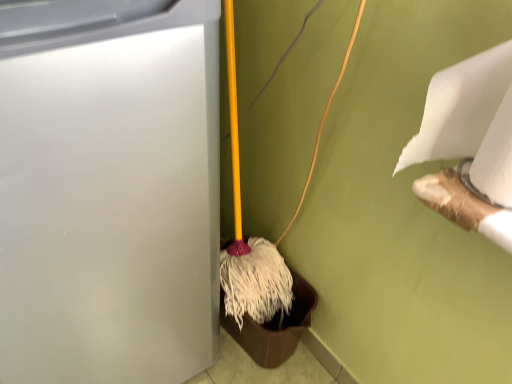
Question: Is white matte toilet paper at upper right, positioned as the 1th toilet paper in left-to-right order, facing towards white matte waste container at left?

Choices:
 (A) no
 (B) yes

Answer: (A)

Question: From a real-world perspective, is white matte toilet paper at upper right, positioned as the 1th toilet paper in left-to-right order, located higher than white matte waste container at left?

Choices:
 (A) yes
 (B) no

Answer: (A)

Question: From a real-world perspective, is white matte toilet paper at upper right, positioned as the 1th toilet paper in left-to-right order, located beneath white matte waste container at left?

Choices:
 (A) no
 (B) yes

Answer: (A)

Question: Considering the relative sizes of white matte toilet paper at upper right, placed as the 2th toilet paper when sorted from right to left, and white matte waste container at left in the image provided, is white matte toilet paper at upper right, placed as the 2th toilet paper when sorted from right to left, smaller than white matte waste container at left?

Choices:
 (A) yes
 (B) no

Answer: (A)

Question: Are white matte toilet paper at upper right, positioned as the 1th toilet paper in left-to-right order, and white matte waste container at left located far from each other?

Choices:
 (A) yes
 (B) no

Answer: (B)

Question: Does white matte toilet paper at upper right, placed as the 2th toilet paper when sorted from right to left, have a greater height compared to white matte waste container at left?

Choices:
 (A) yes
 (B) no

Answer: (B)

Question: Does white matte toilet paper at upper right, positioned as the 1th toilet paper in left-to-right order, turn towards white matte toilet paper at upper right, which is the 1th toilet paper in right-to-left order?

Choices:
 (A) no
 (B) yes

Answer: (B)

Question: Does white matte toilet paper at upper right, positioned as the 1th toilet paper in left-to-right order, have a lesser height compared to white matte toilet paper at upper right, which is the second toilet paper in left-to-right order?

Choices:
 (A) no
 (B) yes

Answer: (B)

Question: Considering the relative sizes of white matte toilet paper at upper right, placed as the 2th toilet paper when sorted from right to left, and white matte toilet paper at upper right, which is the 1th toilet paper in right-to-left order, in the image provided, is white matte toilet paper at upper right, placed as the 2th toilet paper when sorted from right to left, taller than white matte toilet paper at upper right, which is the 1th toilet paper in right-to-left order,?

Choices:
 (A) yes
 (B) no

Answer: (B)

Question: Does white matte toilet paper at upper right, placed as the 2th toilet paper when sorted from right to left, touch white matte toilet paper at upper right, which is the 1th toilet paper in right-to-left order?

Choices:
 (A) no
 (B) yes

Answer: (B)

Question: Is white matte toilet paper at upper right, positioned as the 1th toilet paper in left-to-right order, at the left side of white matte toilet paper at upper right, which is the 1th toilet paper in right-to-left order?

Choices:
 (A) no
 (B) yes

Answer: (B)

Question: From a real-world perspective, does white matte toilet paper at upper right, placed as the 2th toilet paper when sorted from right to left, sit lower than white matte toilet paper at upper right, which is the 1th toilet paper in right-to-left order?

Choices:
 (A) yes
 (B) no

Answer: (A)

Question: Considering the relative sizes of white matte toilet paper at upper right, which is the second toilet paper in left-to-right order, and white matte waste container at left in the image provided, is white matte toilet paper at upper right, which is the second toilet paper in left-to-right order, wider than white matte waste container at left?

Choices:
 (A) no
 (B) yes

Answer: (A)